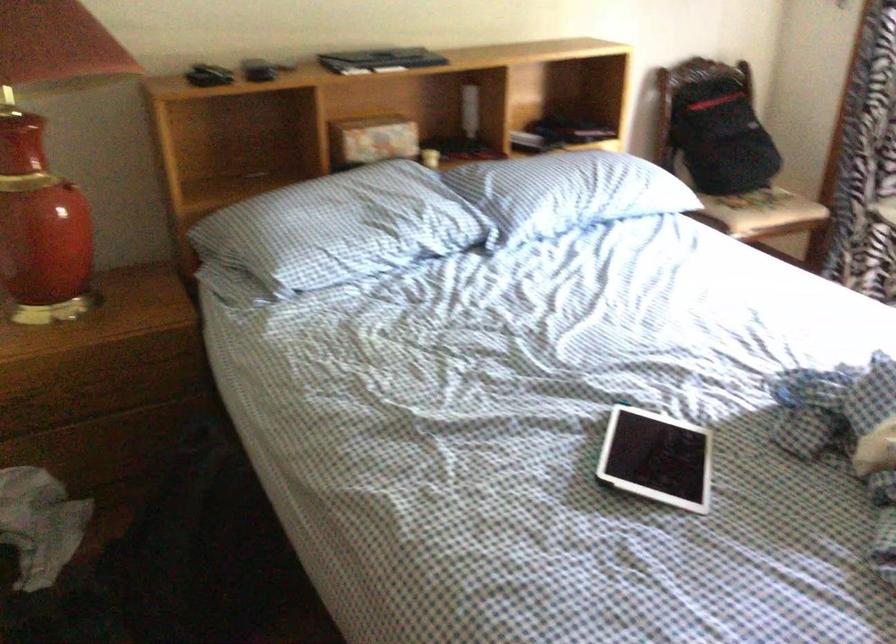
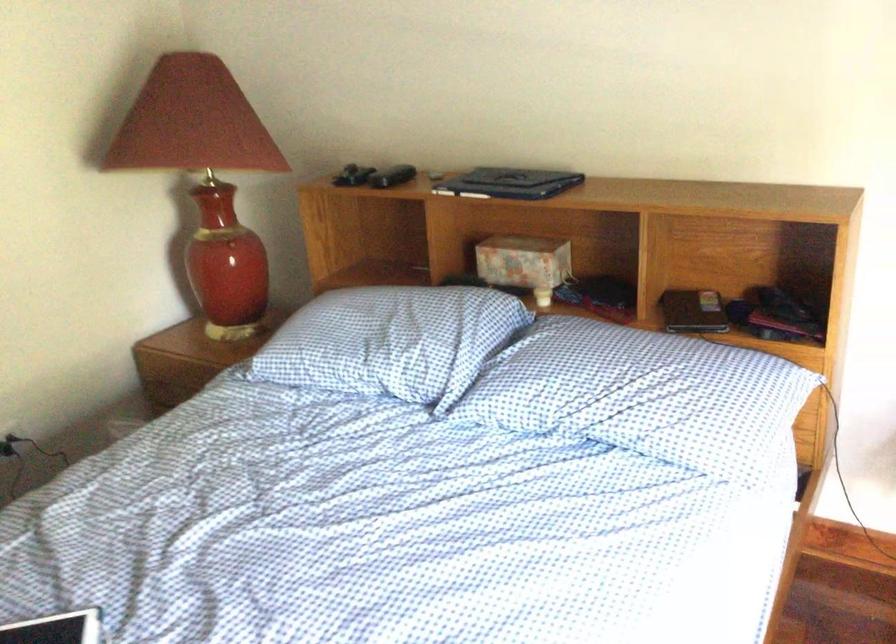
The point at (x=401, y=135) is marked in the first image. Where is the corresponding point in the second image?

(524, 263)